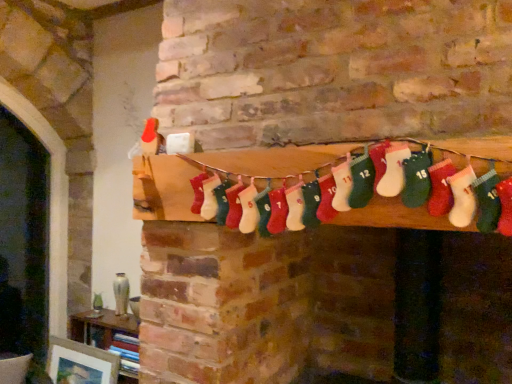
Question: Is red knitted stocking at center to the left of matte white picture frame at lower left from the viewer's perspective?

Choices:
 (A) yes
 (B) no

Answer: (B)

Question: Does red knitted stocking at center come in front of matte white picture frame at lower left?

Choices:
 (A) no
 (B) yes

Answer: (B)

Question: Is red knitted stocking at center bigger than matte white picture frame at lower left?

Choices:
 (A) yes
 (B) no

Answer: (A)

Question: Is red knitted stocking at center facing towards matte white picture frame at lower left?

Choices:
 (A) yes
 (B) no

Answer: (B)

Question: Are red knitted stocking at center and matte white picture frame at lower left far apart?

Choices:
 (A) yes
 (B) no

Answer: (A)

Question: Is red knitted stocking at center wider than matte white picture frame at lower left?

Choices:
 (A) no
 (B) yes

Answer: (B)

Question: Does wooden bookshelf at lower left touch red knitted stocking at center?

Choices:
 (A) yes
 (B) no

Answer: (B)

Question: Is wooden bookshelf at lower left behind red knitted stocking at center?

Choices:
 (A) no
 (B) yes

Answer: (B)

Question: From a real-world perspective, is wooden bookshelf at lower left on top of red knitted stocking at center?

Choices:
 (A) yes
 (B) no

Answer: (B)

Question: Is wooden bookshelf at lower left thinner than red knitted stocking at center?

Choices:
 (A) yes
 (B) no

Answer: (B)

Question: Can you confirm if wooden bookshelf at lower left is shorter than red knitted stocking at center?

Choices:
 (A) yes
 (B) no

Answer: (B)

Question: Is wooden bookshelf at lower left at the left side of red knitted stocking at center?

Choices:
 (A) yes
 (B) no

Answer: (A)

Question: Does matte white picture frame at lower left have a greater height compared to red knitted stocking at center?

Choices:
 (A) yes
 (B) no

Answer: (A)